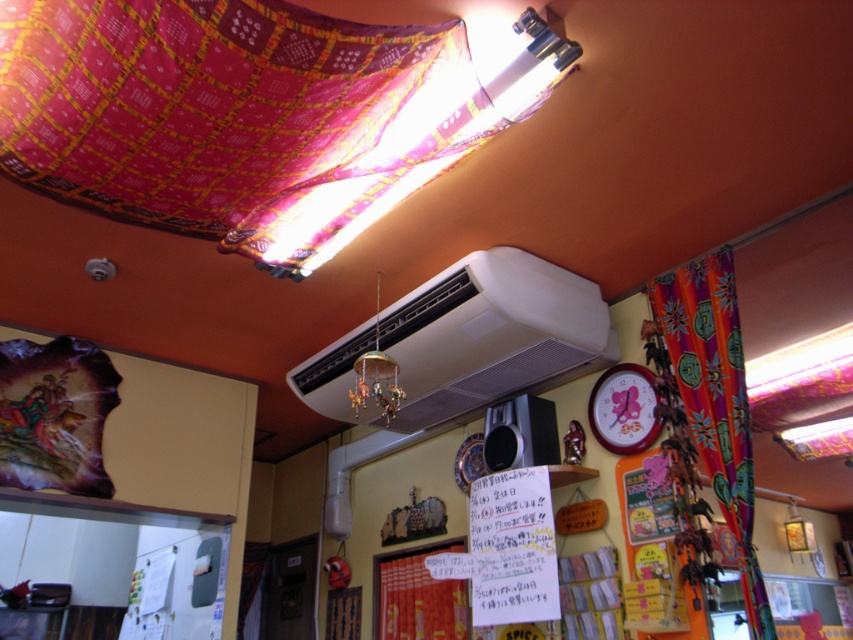
Which is above, multicolored woven cloth at upper center or wooden clock at upper right?

Positioned higher is multicolored woven cloth at upper center.

Describe the element at coordinates (215, 106) in the screenshot. I see `multicolored woven cloth at upper center` at that location.

Image resolution: width=853 pixels, height=640 pixels. What are the coordinates of `multicolored woven cloth at upper center` in the screenshot? It's located at (215, 106).

Looking at this image, does white matte air conditioner at upper center have a greater height compared to wooden clock at upper right?

Correct, white matte air conditioner at upper center is much taller as wooden clock at upper right.

Describe the element at coordinates (489, 332) in the screenshot. I see `white matte air conditioner at upper center` at that location.

I want to click on white matte air conditioner at upper center, so click(489, 332).

Is multicolored woven cloth at upper center behind red fabric tapestry at lower center?

No.

Image resolution: width=853 pixels, height=640 pixels. What do you see at coordinates (215, 106) in the screenshot?
I see `multicolored woven cloth at upper center` at bounding box center [215, 106].

Locate an element on the screen. multicolored woven cloth at upper center is located at coordinates (215, 106).